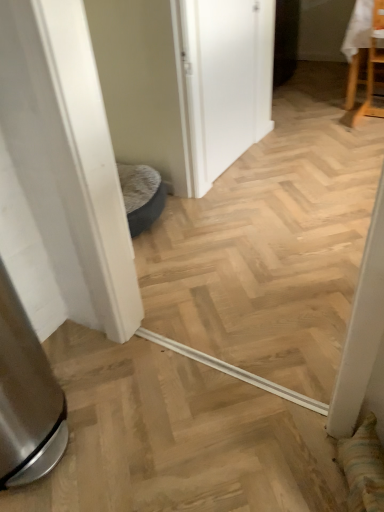
Question: Does point (225, 62) appear closer or farther from the camera than point (379, 10)?

Choices:
 (A) farther
 (B) closer

Answer: (B)

Question: Considering the positions of white matte door at center and wooden chair at upper right in the image, is white matte door at center wider or thinner than wooden chair at upper right?

Choices:
 (A) thin
 (B) wide

Answer: (A)

Question: From a real-world perspective, is white matte door at center positioned above or below wooden chair at upper right?

Choices:
 (A) above
 (B) below

Answer: (A)

Question: Which is correct: wooden chair at upper right is inside white matte door at center, or outside of it?

Choices:
 (A) inside
 (B) outside

Answer: (B)

Question: In terms of height, does wooden chair at upper right look taller or shorter compared to white matte door at center?

Choices:
 (A) short
 (B) tall

Answer: (A)

Question: Considering the positions of wooden chair at upper right and white matte door at center in the image, is wooden chair at upper right wider or thinner than white matte door at center?

Choices:
 (A) thin
 (B) wide

Answer: (B)

Question: From the image's perspective, is wooden chair at upper right positioned above or below white matte door at center?

Choices:
 (A) above
 (B) below

Answer: (A)